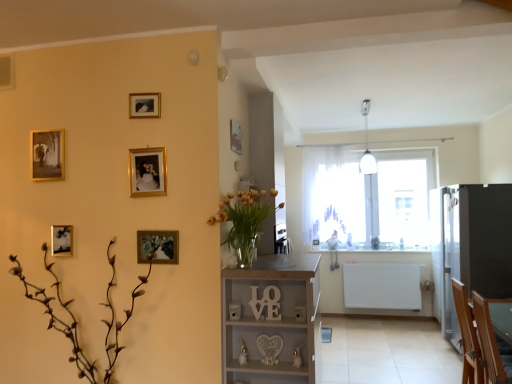
Question: Can you confirm if white plastic light fixture at upper center is bigger than gold metallic picture frame at upper center, the first picture frame viewed from the right?

Choices:
 (A) yes
 (B) no

Answer: (A)

Question: Is white plastic light fixture at upper center at the left side of gold metallic picture frame at upper center, the first picture frame viewed from the right?

Choices:
 (A) no
 (B) yes

Answer: (A)

Question: Is white plastic light fixture at upper center far away from gold metallic picture frame at upper center, the first picture frame viewed from the right?

Choices:
 (A) yes
 (B) no

Answer: (A)

Question: Would you say white plastic light fixture at upper center contains gold metallic picture frame at upper center, the first picture frame viewed from the right?

Choices:
 (A) no
 (B) yes

Answer: (A)

Question: From the image's perspective, is white plastic light fixture at upper center located above gold metallic picture frame at upper center, which is the first picture frame from back to front?

Choices:
 (A) yes
 (B) no

Answer: (A)

Question: Can we say white plastic light fixture at upper center lies outside gold metallic picture frame at upper center, which is the first picture frame from back to front?

Choices:
 (A) no
 (B) yes

Answer: (B)

Question: From the image's perspective, would you say brown matte plant at lower left is shown under white wood shelf at center?

Choices:
 (A) no
 (B) yes

Answer: (A)

Question: Can you confirm if brown matte plant at lower left is thinner than white wood shelf at center?

Choices:
 (A) yes
 (B) no

Answer: (B)

Question: Are brown matte plant at lower left and white wood shelf at center beside each other?

Choices:
 (A) yes
 (B) no

Answer: (B)

Question: Is brown matte plant at lower left bigger than white wood shelf at center?

Choices:
 (A) yes
 (B) no

Answer: (A)

Question: Is brown matte plant at lower left shorter than white wood shelf at center?

Choices:
 (A) yes
 (B) no

Answer: (A)

Question: Is the depth of brown matte plant at lower left greater than that of white wood shelf at center?

Choices:
 (A) no
 (B) yes

Answer: (A)

Question: Is white sheer curtain at center positioned far away from wooden armchair at lower right?

Choices:
 (A) no
 (B) yes

Answer: (B)